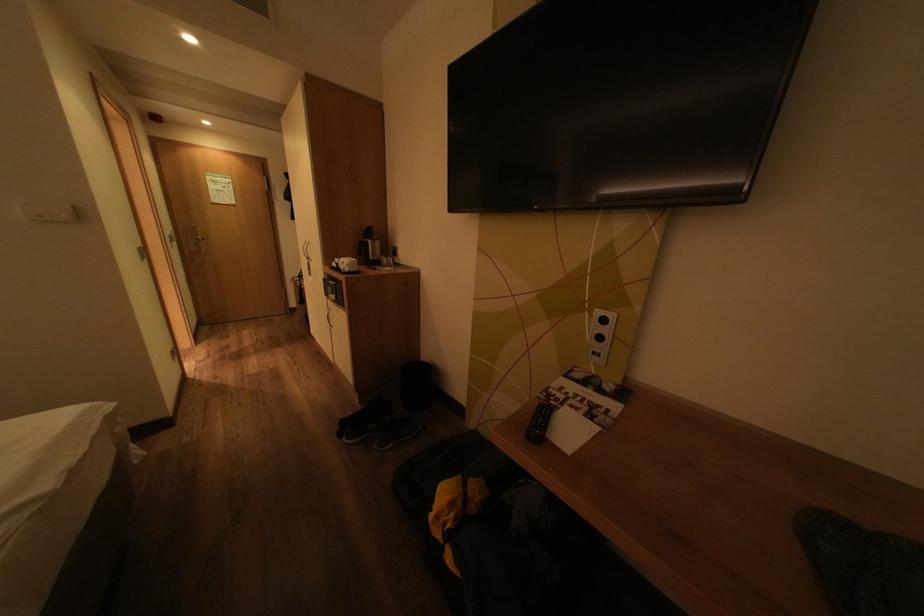
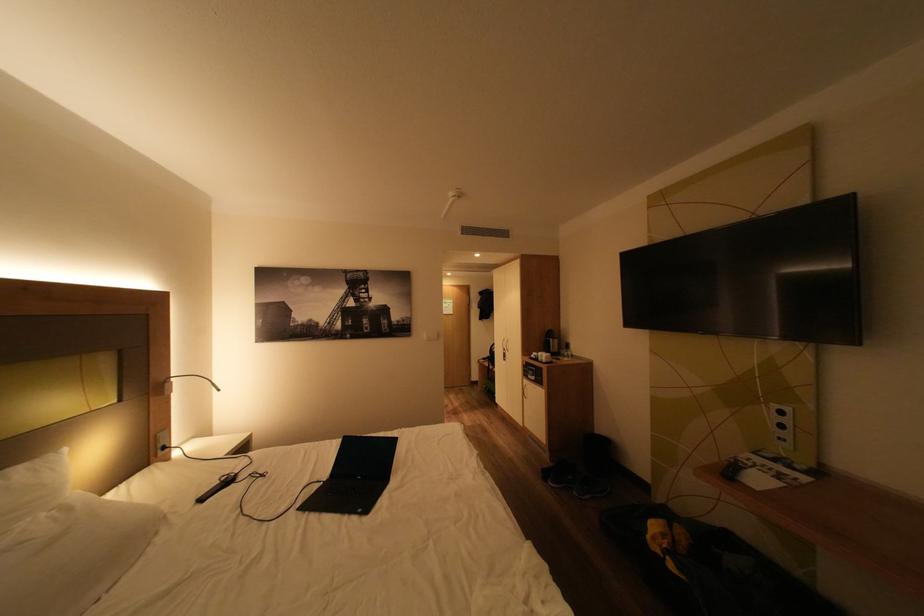
Where in the second image is the point corresponding to pixel 611 339 from the first image?

(793, 427)